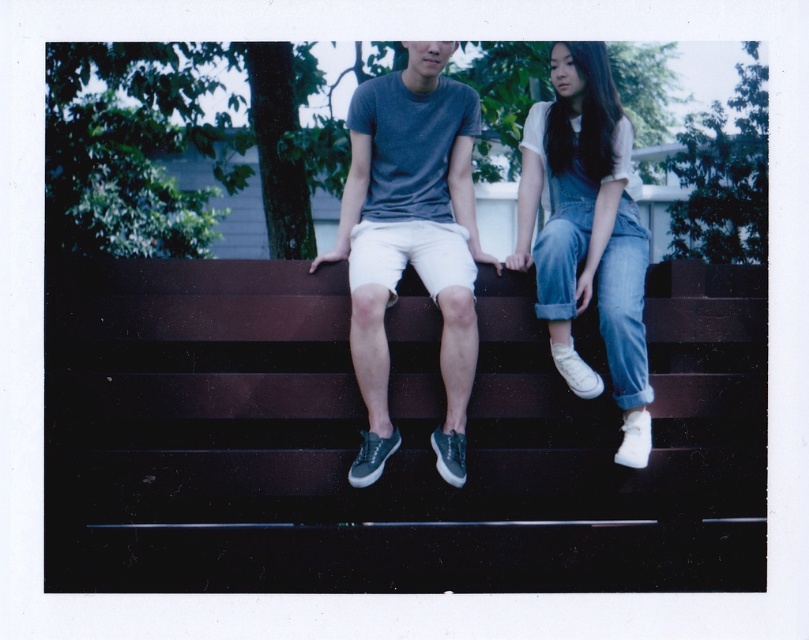
Between point (464, 216) and point (564, 51), which one is positioned behind?

The point (464, 216) is behind.

Can you confirm if matte gray t-shirt at center is positioned to the right of denim overalls at right?

In fact, matte gray t-shirt at center is to the left of denim overalls at right.

Is point (382, 211) closer to viewer compared to point (634, 390)?

That is False.

Find the location of a particular element. matte gray t-shirt at center is located at coordinates (411, 240).